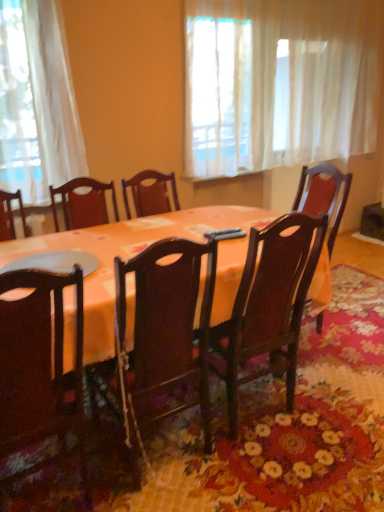
You are a GUI agent. You are given a task and a screenshot of the screen. Output one action in this format:
    pyautogui.click(x=<x>, y=<y>)
    Task: Click on the free spot in front of wooden chair at center, positioned as the second chair in left-to-right order
    This screenshot has width=384, height=512.
    Given the screenshot: What is the action you would take?
    pyautogui.click(x=284, y=474)